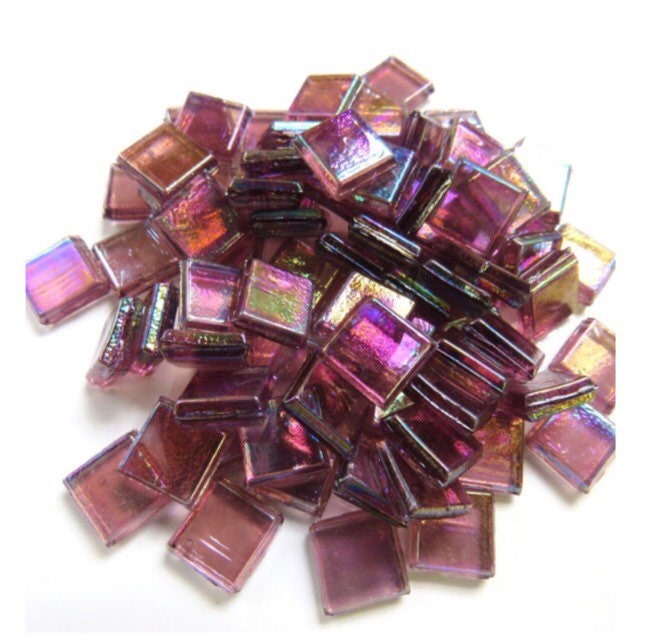
The image size is (657, 642). I want to click on tiles, so click(x=332, y=275).